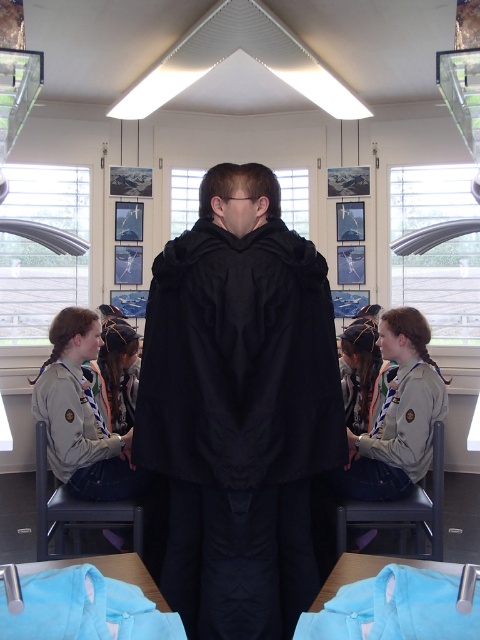
Question: Estimate the real-world distances between objects in this image. Which object is farther from the light blue fabric at lower center?

Choices:
 (A) black matte robe at center
 (B) light blue fabric at lower left

Answer: (A)

Question: Is black matte robe at center to the left of light blue fabric at lower left from the viewer's perspective?

Choices:
 (A) no
 (B) yes

Answer: (A)

Question: Does black matte robe at center appear on the left side of light blue fabric at lower left?

Choices:
 (A) no
 (B) yes

Answer: (A)

Question: Which of these objects is positioned closest to the black matte robe at center?

Choices:
 (A) light blue fabric at lower left
 (B) light blue fabric at lower center

Answer: (A)

Question: Does black matte robe at center have a smaller size compared to light blue fabric at lower center?

Choices:
 (A) no
 (B) yes

Answer: (A)

Question: Among these points, which one is nearest to the camera?

Choices:
 (A) (105, 563)
 (B) (310, 621)

Answer: (B)